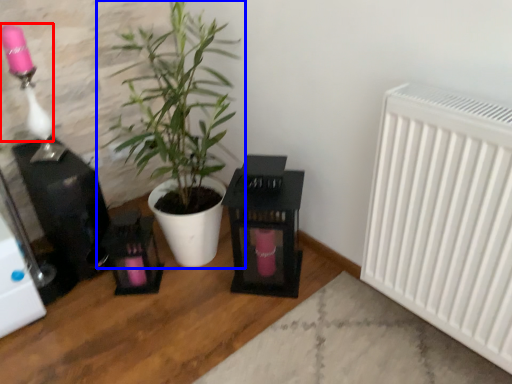
Question: Which point is closer to the camera, lamp (highlighted by a red box) or houseplant (highlighted by a blue box)?

Choices:
 (A) lamp
 (B) houseplant

Answer: (B)